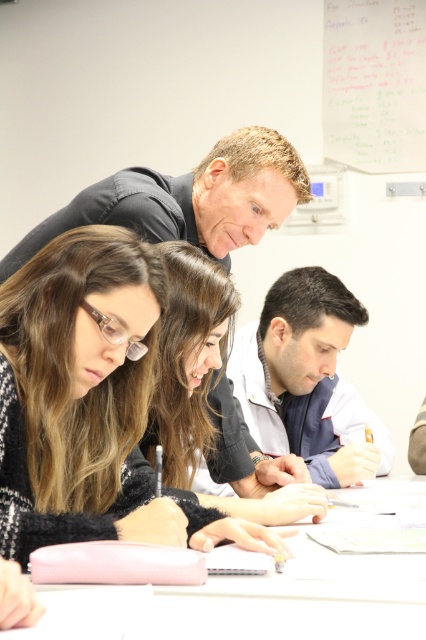
Question: Is dark blue shirt at upper center bigger than smooth black hair at center?

Choices:
 (A) yes
 (B) no

Answer: (A)

Question: Among these points, which one is nearest to the camera?

Choices:
 (A) click(77, 484)
 (B) click(204, 433)

Answer: (A)

Question: Is smooth black hair at center positioned at the back of whiteboard at upper right?

Choices:
 (A) no
 (B) yes

Answer: (A)

Question: Which of these objects is positioned closest to the white fabric shirt at lower right?

Choices:
 (A) dark blue shirt at upper center
 (B) smooth black hair at center

Answer: (B)

Question: Which of the following is the farthest from the observer?

Choices:
 (A) (252, 605)
 (B) (347, 10)
 (C) (239, 388)

Answer: (B)

Question: Is smooth black hair at center bigger than whiteboard at upper right?

Choices:
 (A) no
 (B) yes

Answer: (B)